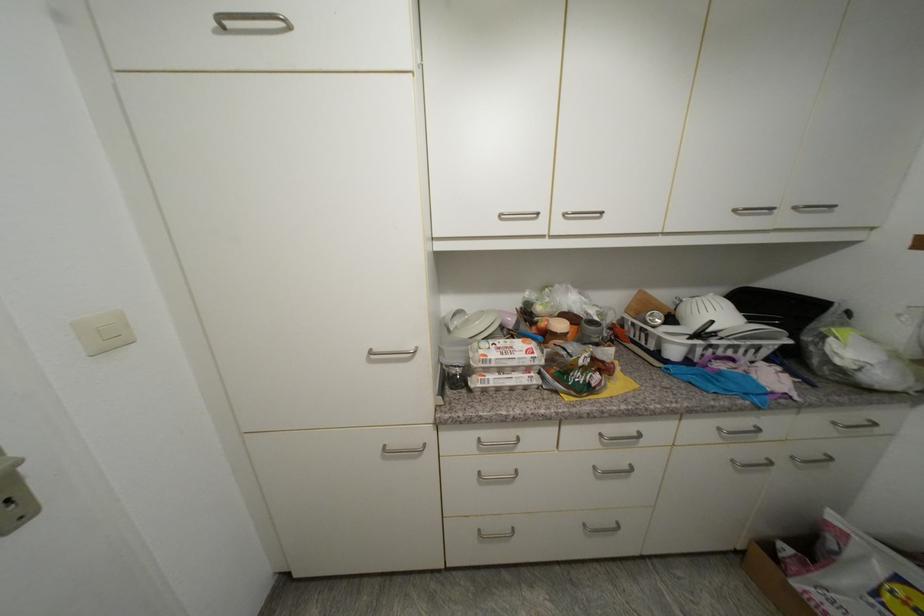
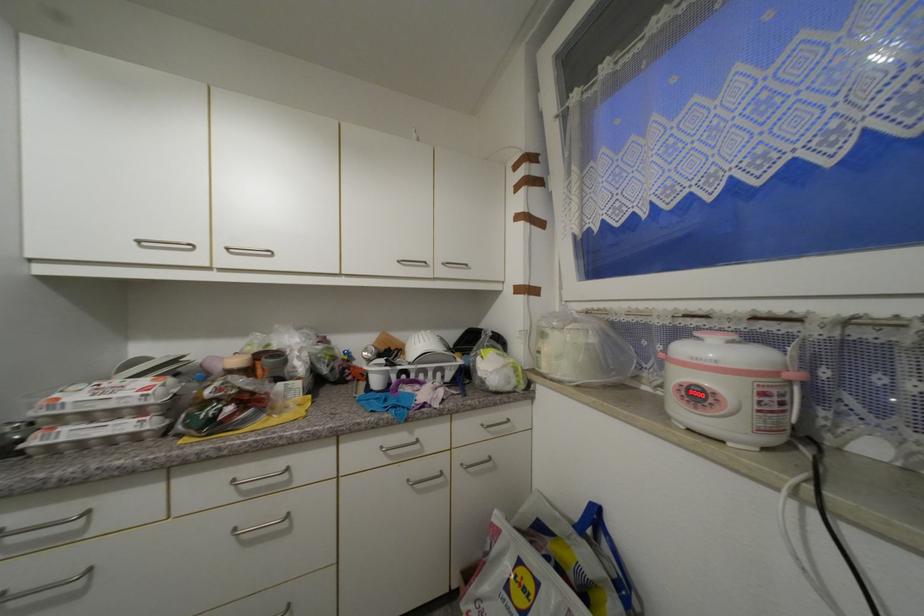
Question: In a continuous first-person perspective shot, in which direction is the camera moving?

Choices:
 (A) Left
 (B) Right
 (C) Forward
 (D) Backward

Answer: (B)